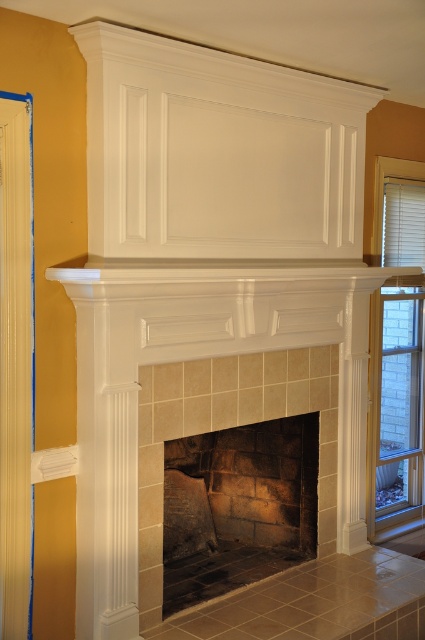
Is dark stone fireplace at center below white blinds at right?

Correct, dark stone fireplace at center is located below white blinds at right.

Looking at this image, is dark stone fireplace at center thinner than white blinds at right?

In fact, dark stone fireplace at center might be wider than white blinds at right.

Find the location of a particular element. dark stone fireplace at center is located at coordinates (238, 508).